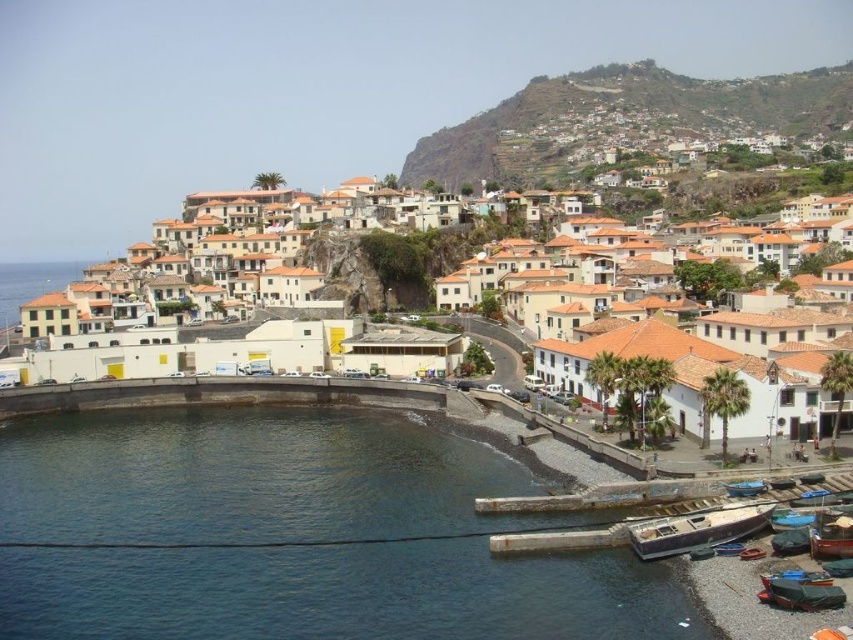
Which of these two, green grassy hillside at upper center or white matte building at center, stands shorter?

With less height is white matte building at center.

Is green grassy hillside at upper center to the left of white matte building at center from the viewer's perspective?

In fact, green grassy hillside at upper center is to the right of white matte building at center.

Who is more distant from viewer, [763,81] or [305,257]?

Positioned behind is point [763,81].

The height and width of the screenshot is (640, 853). I want to click on green grassy hillside at upper center, so click(622, 118).

Does point (734, 524) lie in front of point (807, 518)?

No, it is behind (807, 518).

Who is shorter, white fiberglass boat at lower right or blue plastic boat at lower right?

blue plastic boat at lower right is shorter.

Where is `white fiberglass boat at lower right`? white fiberglass boat at lower right is located at coordinates 695,529.

Who is positioned more to the left, dark blue water at lower left or green grassy hillside at upper center?

dark blue water at lower left

I want to click on dark blue water at lower left, so click(x=294, y=534).